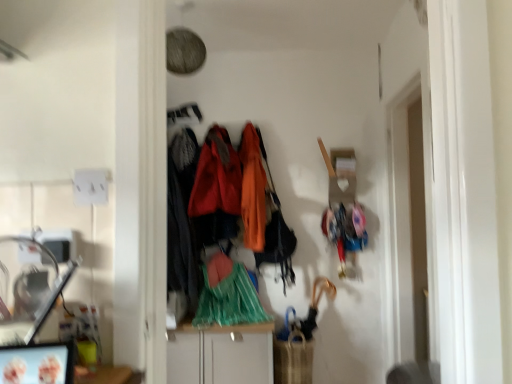
What do you see at coordinates (216, 189) in the screenshot? I see `velvet orange coat at center, which appears as the second clothing when viewed from the left` at bounding box center [216, 189].

This screenshot has width=512, height=384. Describe the element at coordinates (182, 217) in the screenshot. I see `velvet-like black coat at center, positioned as the fourth clothing in right-to-left order` at that location.

Describe the element at coordinates (252, 190) in the screenshot. This screenshot has height=384, width=512. I see `orange fabric coat at center, acting as the first clothing starting from the right` at that location.

What do you see at coordinates (230, 301) in the screenshot?
I see `green plastic bag at center, the second clothing from the right` at bounding box center [230, 301].

Locate an element on the screen. Image resolution: width=512 pixels, height=384 pixels. white glossy cabinet at center is located at coordinates (220, 354).

Image resolution: width=512 pixels, height=384 pixels. I want to click on the 2nd clothing below when counting from the orange fabric coat at center, acting as the first clothing starting from the right (from the image's perspective), so click(x=230, y=301).

From the image's perspective, is green plastic bag at center, which is the third clothing in left-to-right order, under orange fabric coat at center, which appears as the fourth clothing when viewed from the left?

Correct, green plastic bag at center, which is the third clothing in left-to-right order, appears lower than orange fabric coat at center, which appears as the fourth clothing when viewed from the left, in the image.

Which is behind, point (208, 323) or point (259, 184)?

The point (259, 184) is farther from the camera.

Between green plastic bag at center, the second clothing from the right, and orange fabric coat at center, which appears as the fourth clothing when viewed from the left, which one has larger size?

Bigger between the two is green plastic bag at center, the second clothing from the right.

Considering the sizes of velvet-like black coat at center, positioned as the fourth clothing in right-to-left order, and velvet orange coat at center, which ranks as the 3th clothing in right-to-left order, in the image, is velvet-like black coat at center, positioned as the fourth clothing in right-to-left order, taller or shorter than velvet orange coat at center, which ranks as the 3th clothing in right-to-left order,?

In the image, velvet-like black coat at center, positioned as the fourth clothing in right-to-left order, appears to be taller than velvet orange coat at center, which ranks as the 3th clothing in right-to-left order.

You are a GUI agent. You are given a task and a screenshot of the screen. Output one action in this format:
    pyautogui.click(x=<x>, y=<y>)
    Task: Click on the clothing that is the 1st one when counting forward from the velvet orange coat at center, which appears as the second clothing when viewed from the left
    Image resolution: width=512 pixels, height=384 pixels.
    Given the screenshot: What is the action you would take?
    click(182, 217)

Who is bigger, velvet-like black coat at center, positioned as the fourth clothing in right-to-left order, or velvet orange coat at center, which appears as the second clothing when viewed from the left?

velvet-like black coat at center, positioned as the fourth clothing in right-to-left order, is bigger.

You are a GUI agent. You are given a task and a screenshot of the screen. Output one action in this format:
    pyautogui.click(x=<x>, y=<y>)
    Task: Click on the clothing that is the 2nd one when counting forward from the velvet orange coat at center, which appears as the second clothing when viewed from the left
    The height and width of the screenshot is (384, 512).
    Given the screenshot: What is the action you would take?
    pyautogui.click(x=230, y=301)

Can you confirm if velvet orange coat at center, which appears as the second clothing when viewed from the left, is positioned to the right of green plastic bag at center, which is the third clothing in left-to-right order?

Incorrect, velvet orange coat at center, which appears as the second clothing when viewed from the left, is not on the right side of green plastic bag at center, which is the third clothing in left-to-right order.

Which of these two, velvet orange coat at center, which ranks as the 3th clothing in right-to-left order, or green plastic bag at center, which is the third clothing in left-to-right order, is thinner?

velvet orange coat at center, which ranks as the 3th clothing in right-to-left order.

Does orange fabric coat at center, acting as the first clothing starting from the right, have a greater height compared to velvet-like black coat at center, positioned as the fourth clothing in right-to-left order?

Incorrect, the height of orange fabric coat at center, acting as the first clothing starting from the right, is not larger of that of velvet-like black coat at center, positioned as the fourth clothing in right-to-left order.

Is orange fabric coat at center, acting as the first clothing starting from the right, inside the boundaries of velvet-like black coat at center, positioned as the fourth clothing in right-to-left order, or outside?

orange fabric coat at center, acting as the first clothing starting from the right, is not inside velvet-like black coat at center, positioned as the fourth clothing in right-to-left order, it's outside.

At what (x,y) coordinates should I click in order to perform the action: click on clothing that is the 3rd one when counting rightward from the velvet-like black coat at center, which appears as the first clothing when viewed from the left. Please return your answer as a coordinate pair (x, y). Looking at the image, I should click on click(252, 190).

From the image's perspective, would you say orange fabric coat at center, acting as the first clothing starting from the right, is shown under velvet-like black coat at center, positioned as the fourth clothing in right-to-left order?

Incorrect, from the image's perspective, orange fabric coat at center, acting as the first clothing starting from the right, is higher than velvet-like black coat at center, positioned as the fourth clothing in right-to-left order.

Is white glossy cabinet at center wider or thinner than velvet-like black coat at center, which appears as the first clothing when viewed from the left?

In the image, white glossy cabinet at center appears to be wider than velvet-like black coat at center, which appears as the first clothing when viewed from the left.

From the image's perspective, is white glossy cabinet at center over velvet-like black coat at center, which appears as the first clothing when viewed from the left?

No, from the image's perspective, white glossy cabinet at center is not above velvet-like black coat at center, which appears as the first clothing when viewed from the left.

What's the angular difference between white glossy cabinet at center and velvet-like black coat at center, which appears as the first clothing when viewed from the left,'s facing directions?

7.23 degrees.

Is the depth of white glossy cabinet at center greater than that of velvet-like black coat at center, positioned as the fourth clothing in right-to-left order?

No, it is not.

Is velvet-like black coat at center, which appears as the first clothing when viewed from the left, positioned with its back to green plastic bag at center, which is the third clothing in left-to-right order?

No, green plastic bag at center, which is the third clothing in left-to-right order, is not at the back of velvet-like black coat at center, which appears as the first clothing when viewed from the left.

Is the position of velvet-like black coat at center, which appears as the first clothing when viewed from the left, less distant than that of green plastic bag at center, which is the third clothing in left-to-right order?

No, it is behind green plastic bag at center, which is the third clothing in left-to-right order.

Which of these two, velvet-like black coat at center, which appears as the first clothing when viewed from the left, or green plastic bag at center, the second clothing from the right, is bigger?

With larger size is velvet-like black coat at center, which appears as the first clothing when viewed from the left.

Is the surface of velvet-like black coat at center, positioned as the fourth clothing in right-to-left order, in direct contact with green plastic bag at center, the second clothing from the right?

No, velvet-like black coat at center, positioned as the fourth clothing in right-to-left order, is not beside green plastic bag at center, the second clothing from the right.

Starting from the orange fabric coat at center, acting as the first clothing starting from the right, which clothing is the 1st one in front? Please provide its 2D coordinates.

[(216, 189)]

Can you tell me how much velvet orange coat at center, which ranks as the 3th clothing in right-to-left order, and orange fabric coat at center, acting as the first clothing starting from the right, differ in facing direction?

4.76e-05 degrees.

Based on the photo, would you say velvet orange coat at center, which ranks as the 3th clothing in right-to-left order, is a long distance from orange fabric coat at center, which appears as the fourth clothing when viewed from the left?

velvet orange coat at center, which ranks as the 3th clothing in right-to-left order, is actually quite close to orange fabric coat at center, which appears as the fourth clothing when viewed from the left.

From a real-world perspective, relative to orange fabric coat at center, acting as the first clothing starting from the right, is velvet orange coat at center, which ranks as the 3th clothing in right-to-left order, vertically above or below?

From a real-world perspective, velvet orange coat at center, which ranks as the 3th clothing in right-to-left order, is physically above orange fabric coat at center, acting as the first clothing starting from the right.

I want to click on the 2nd clothing below the orange fabric coat at center, which appears as the fourth clothing when viewed from the left (from the image's perspective), so click(230, 301).

The width and height of the screenshot is (512, 384). What are the coordinates of `clothing on the left of velvet orange coat at center, which appears as the second clothing when viewed from the left` in the screenshot? It's located at (182, 217).

When comparing their distances from velvet orange coat at center, which ranks as the 3th clothing in right-to-left order, does green plastic bag at center, the second clothing from the right, or velvet-like black coat at center, positioned as the fourth clothing in right-to-left order, seem closer?

velvet-like black coat at center, positioned as the fourth clothing in right-to-left order, lies closer to velvet orange coat at center, which ranks as the 3th clothing in right-to-left order, than the other object.

Considering their positions, is green plastic bag at center, which is the third clothing in left-to-right order, positioned further to velvet-like black coat at center, which appears as the first clothing when viewed from the left, than white glossy cabinet at center?

Based on the image, white glossy cabinet at center appears to be further to velvet-like black coat at center, which appears as the first clothing when viewed from the left.

When comparing their distances from velvet-like black coat at center, which appears as the first clothing when viewed from the left, does orange fabric coat at center, acting as the first clothing starting from the right, or green plastic bag at center, the second clothing from the right, seem further?

Among the two, orange fabric coat at center, acting as the first clothing starting from the right, is located further to velvet-like black coat at center, which appears as the first clothing when viewed from the left.

Looking at the image, which one is located closer to velvet-like black coat at center, positioned as the fourth clothing in right-to-left order, orange fabric coat at center, which appears as the fourth clothing when viewed from the left, or white glossy cabinet at center?

orange fabric coat at center, which appears as the fourth clothing when viewed from the left, lies closer to velvet-like black coat at center, positioned as the fourth clothing in right-to-left order, than the other object.

Which object lies further to the anchor point orange fabric coat at center, acting as the first clothing starting from the right, green plastic bag at center, which is the third clothing in left-to-right order, or velvet orange coat at center, which ranks as the 3th clothing in right-to-left order?

green plastic bag at center, which is the third clothing in left-to-right order, lies further to orange fabric coat at center, acting as the first clothing starting from the right, than the other object.

Which object lies further to the anchor point velvet orange coat at center, which ranks as the 3th clothing in right-to-left order, velvet-like black coat at center, positioned as the fourth clothing in right-to-left order, or green plastic bag at center, the second clothing from the right?

Among the two, green plastic bag at center, the second clothing from the right, is located further to velvet orange coat at center, which ranks as the 3th clothing in right-to-left order.

Estimate the real-world distances between objects in this image. Which object is further from green plastic bag at center, which is the third clothing in left-to-right order, velvet-like black coat at center, positioned as the fourth clothing in right-to-left order, or velvet orange coat at center, which ranks as the 3th clothing in right-to-left order?

velvet orange coat at center, which ranks as the 3th clothing in right-to-left order, is further to green plastic bag at center, which is the third clothing in left-to-right order.

Which object lies nearer to the anchor point white glossy cabinet at center, velvet-like black coat at center, positioned as the fourth clothing in right-to-left order, or green plastic bag at center, which is the third clothing in left-to-right order?

Based on the image, green plastic bag at center, which is the third clothing in left-to-right order, appears to be nearer to white glossy cabinet at center.

Find the location of a particular element. The image size is (512, 384). clothing between orange fabric coat at center, acting as the first clothing starting from the right, and green plastic bag at center, the second clothing from the right, from top to bottom is located at coordinates (182, 217).

This screenshot has height=384, width=512. I want to click on clothing that lies between velvet-like black coat at center, positioned as the fourth clothing in right-to-left order, and white glossy cabinet at center from top to bottom, so click(230, 301).